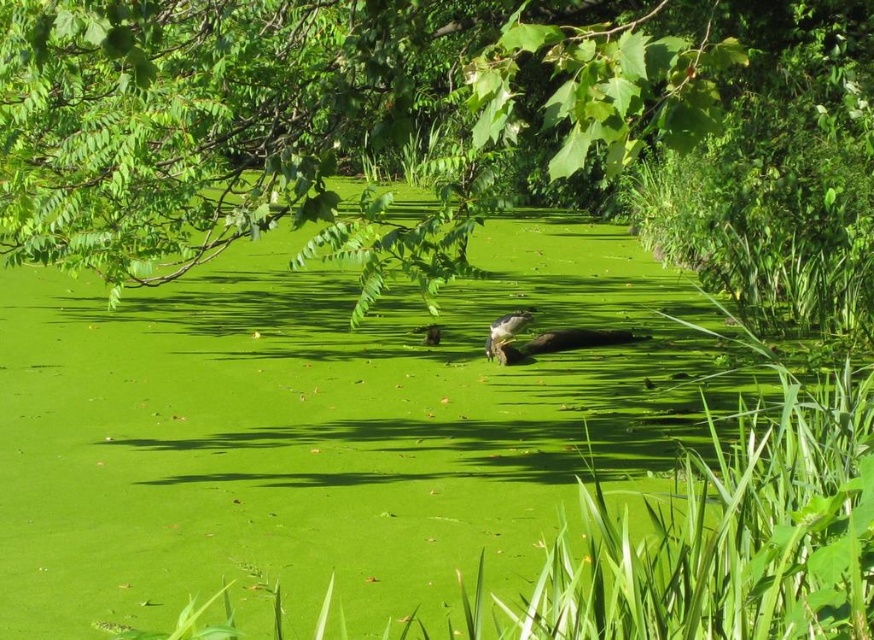
Who is positioned more to the left, dark brown fur duck at center or dark brown fur at center?

dark brown fur at center

Based on the photo, does dark brown fur duck at center have a greater height compared to dark brown fur at center?

No.

Between point (600, 330) and point (526, 323), which one is positioned behind?

The point (600, 330) is behind.

You are a GUI agent. You are given a task and a screenshot of the screen. Output one action in this format:
    pyautogui.click(x=<x>, y=<y>)
    Task: Click on the dark brown fur duck at center
    The width and height of the screenshot is (874, 640).
    Given the screenshot: What is the action you would take?
    [577, 339]

Is point (594, 339) positioned before point (434, 340)?

No, (594, 339) is further to viewer.

Looking at this image, does dark brown fur duck at center have a larger size compared to brown furry bird at center?

Yes.

Does point (630, 339) come in front of point (431, 333)?

No, it is not.

Locate an element on the screen. The width and height of the screenshot is (874, 640). dark brown fur duck at center is located at coordinates (577, 339).

Who is lower down, green leafy tree at center or dark brown fur duck at center?

dark brown fur duck at center is lower down.

Which is more to the left, green leafy tree at center or dark brown fur duck at center?

green leafy tree at center

Is point (203, 224) less distant than point (635, 337)?

Yes, it is in front of point (635, 337).

Identify the location of green leafy tree at center. (202, 131).